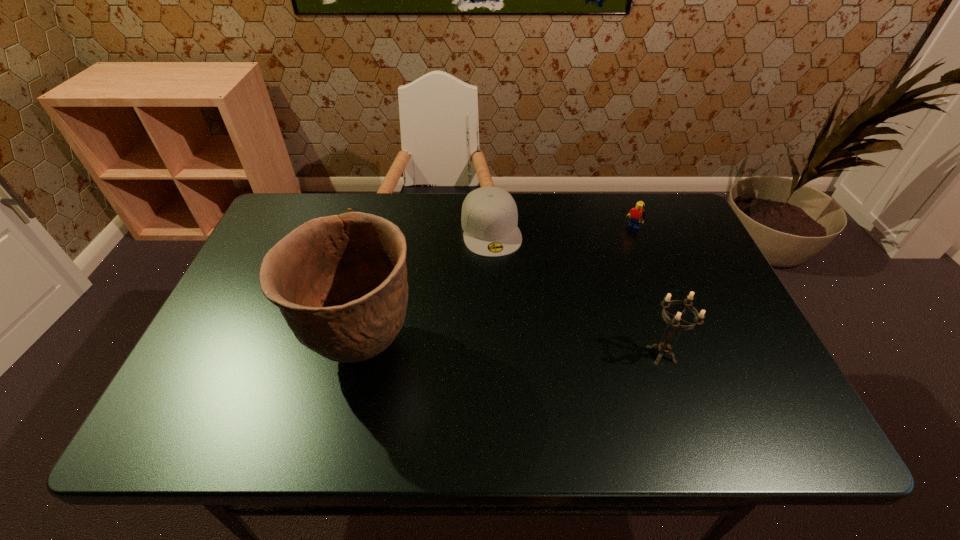
Identify the location of pottery that is at the near edge. (340, 282).

You are a GUI agent. You are given a task and a screenshot of the screen. Output one action in this format:
    pyautogui.click(x=<x>, y=<y>)
    Task: Click on the candle holder that is positioned at the near edge
    The height and width of the screenshot is (540, 960).
    Given the screenshot: What is the action you would take?
    pyautogui.click(x=664, y=347)

Find the location of a particular element. Image resolution: width=960 pixels, height=540 pixels. object situated at the left edge is located at coordinates (347, 208).

At what (x,y) coordinates should I click in order to perform the action: click on object that is at the right edge. Please return your answer as a coordinate pair (x, y). The image size is (960, 540). Looking at the image, I should click on tap(637, 215).

What are the coordinates of `object that is positioned at the far left corner` in the screenshot? It's located at (347, 208).

Identify the location of object present at the far right corner. This screenshot has width=960, height=540. (637, 215).

What are the coordinates of `vacant space at the far edge` in the screenshot? It's located at (356, 194).

In the image, there is a desktop. In order to click on free region at the near edge in this screenshot , I will do `click(655, 373)`.

The width and height of the screenshot is (960, 540). Find the location of `vacant space at the left edge of the desktop`. vacant space at the left edge of the desktop is located at coordinates (265, 308).

Where is `vacant space at the right edge`? vacant space at the right edge is located at coordinates (673, 255).